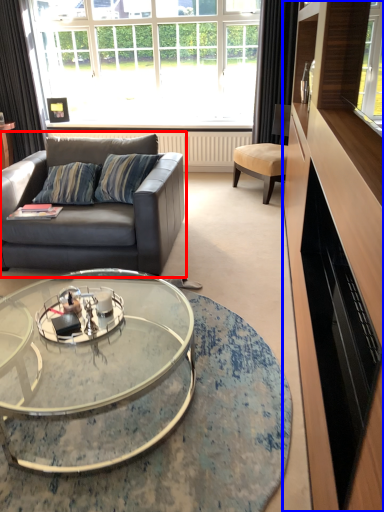
Question: Which object appears closest to the camera in this image, studio couch (highlighted by a red box) or entertainment center (highlighted by a blue box)?

Choices:
 (A) studio couch
 (B) entertainment center

Answer: (B)